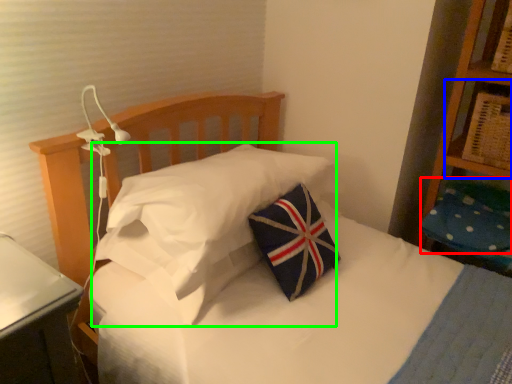
Question: Considering the real-world distances, which object is farthest from pillow (highlighted by a red box)? shelf (highlighted by a blue box) or pillow (highlighted by a green box)?

Choices:
 (A) shelf
 (B) pillow

Answer: (B)